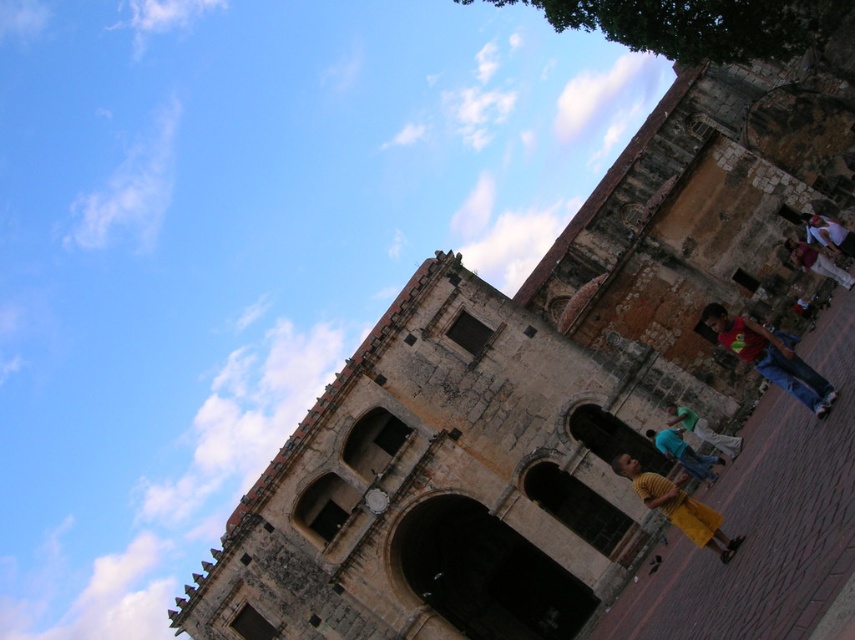
Question: Considering the real-world distances, which object is closest to the yellow matte skirt at lower right?

Choices:
 (A) red cotton shirt at right
 (B) yellow cotton shirt at center
 (C) green fabric shirt at center
 (D) light brown leather jacket at right

Answer: (C)

Question: Which of the following is the closest to the observer?

Choices:
 (A) (853, 241)
 (B) (820, 256)
 (C) (671, 513)

Answer: (C)

Question: Can you confirm if yellow matte skirt at lower right is positioned to the right of white cotton shirt at right?

Choices:
 (A) yes
 (B) no

Answer: (B)

Question: Is green fabric shirt at center to the left of light brown leather jacket at right from the viewer's perspective?

Choices:
 (A) no
 (B) yes

Answer: (B)

Question: Which object is the farthest from the green fabric shirt at center?

Choices:
 (A) yellow cotton shirt at center
 (B) white cotton shirt at right

Answer: (B)

Question: Is yellow matte skirt at lower right below white cotton shirt at right?

Choices:
 (A) yes
 (B) no

Answer: (A)